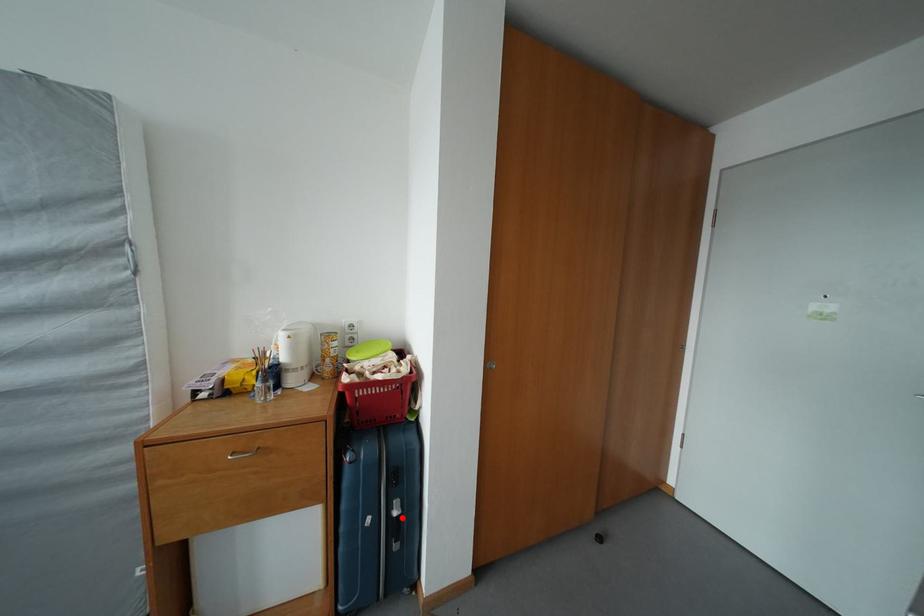
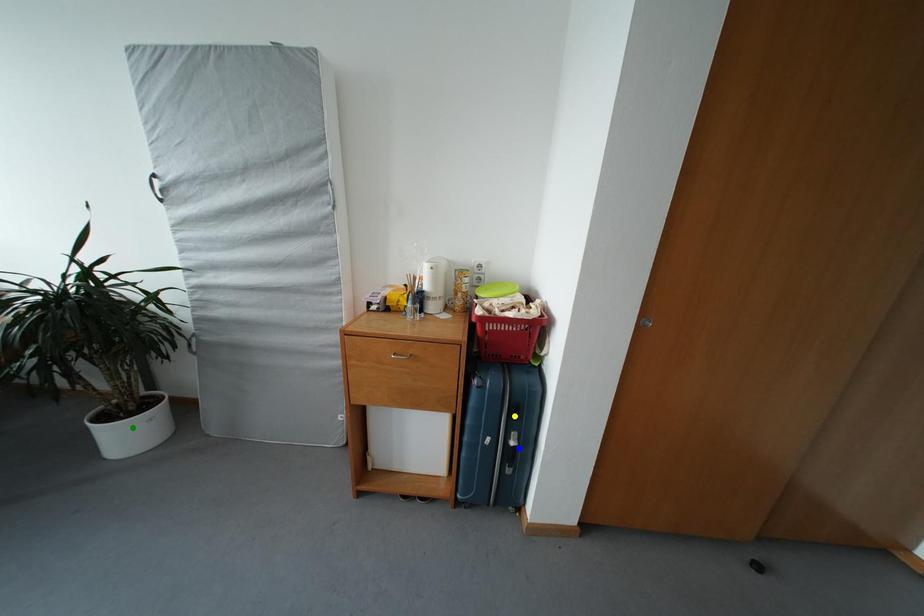
Question: I am providing you with two images of the same scene from different viewpoints. A red point is marked on the first image. You are given multiple points on the second image. Which mark in image 2 goes with the point in image 1?

Choices:
 (A) blue point
 (B) yellow point
 (C) green point

Answer: (A)